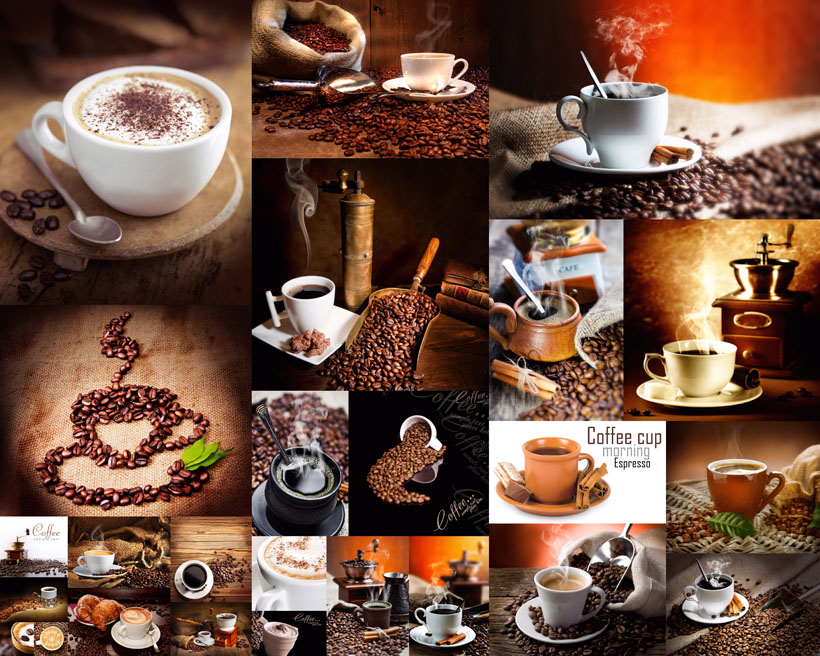
Identify the location of non white coffee cup. (285, 504), (11, 642), (287, 634), (550, 461), (553, 340), (739, 480).